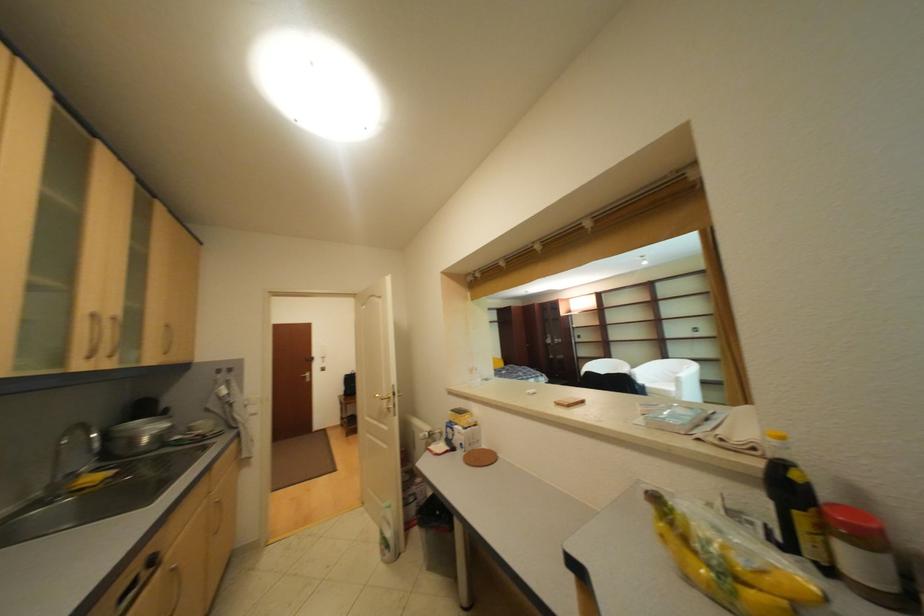
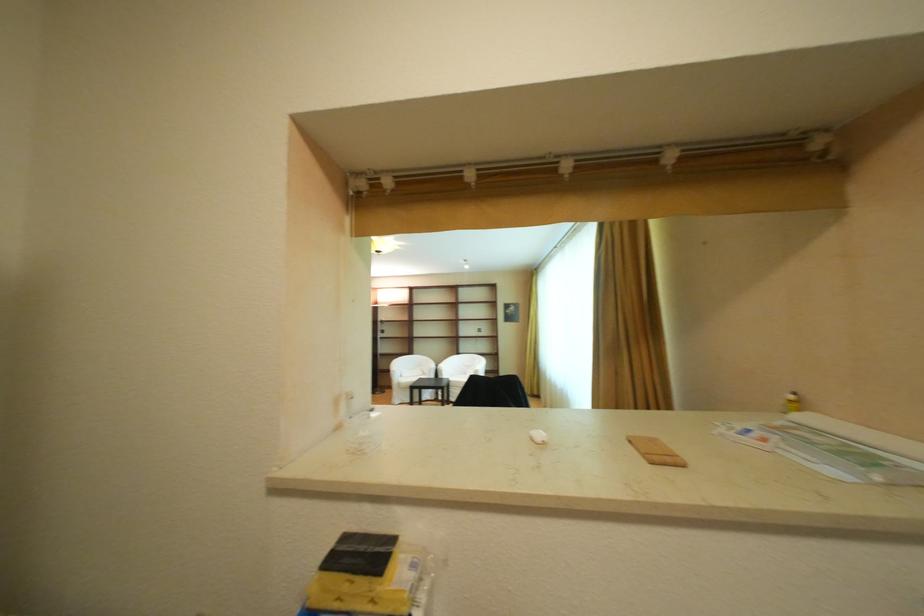
The point at (478, 300) is marked in the first image. Where is the corresponding point in the second image?

(351, 228)